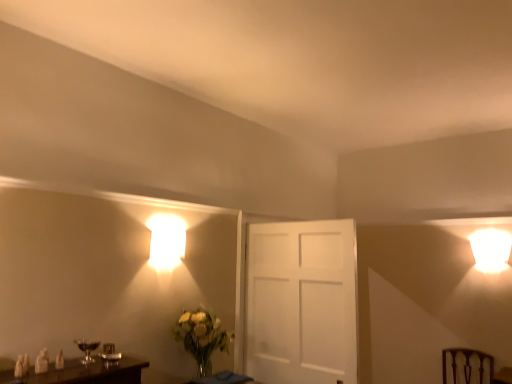
The image size is (512, 384). What do you see at coordinates (87, 349) in the screenshot?
I see `matte glass wine glass at lower left` at bounding box center [87, 349].

The height and width of the screenshot is (384, 512). Describe the element at coordinates (223, 378) in the screenshot. I see `translucent glass table at lower center` at that location.

The image size is (512, 384). Describe the element at coordinates (466, 363) in the screenshot. I see `brown wooden swivel chair at lower right` at that location.

What do you see at coordinates (202, 337) in the screenshot? I see `translucent glass vase at lower left` at bounding box center [202, 337].

In order to face translucent glass vase at lower left, should I rotate leftwards or rightwards?

To align with it, rotate left about 6.662°.

Where is `matte glass wine glass at lower left`? matte glass wine glass at lower left is located at coordinates (87, 349).

Is translucent glass vase at lower left not near matte glass wine glass at lower left?

No.

At what (x,y) coordinates should I click in order to perform the action: click on floral arrangement below the matte glass wine glass at lower left (from a real-world perspective). Please return your answer as a coordinate pair (x, y). Image resolution: width=512 pixels, height=384 pixels. Looking at the image, I should click on (202, 337).

From a real-world perspective, relative to matte glass wine glass at lower left, is translucent glass vase at lower left vertically above or below?

Clearly, from a real-world perspective, translucent glass vase at lower left is below matte glass wine glass at lower left.

Can you confirm if translucent glass vase at lower left is positioned to the left of matte glass wine glass at lower left?

No, translucent glass vase at lower left is not to the left of matte glass wine glass at lower left.

Based on the photo, how different are the orientations of translucent glass vase at lower left and translucent glass table at lower center in degrees?

The angle between the facing direction of translucent glass vase at lower left and the facing direction of translucent glass table at lower center is 1.85 degrees.

Is translucent glass vase at lower left oriented away from translucent glass table at lower center?

No, translucent glass table at lower center is not at the back of translucent glass vase at lower left.

Is point (207, 365) behind point (246, 382)?

That is False.

Is point (233, 377) positioned before point (470, 372)?

Yes, it is.

In order to click on table above the brown wooden swivel chair at lower right (from a real-world perspective) in this screenshot , I will do `click(223, 378)`.

From the image's perspective, relative to brown wooden swivel chair at lower right, is translucent glass table at lower center above or below?

From the image's perspective, translucent glass table at lower center appears above brown wooden swivel chair at lower right.

In the scene shown: Which is in front, matte glass wine glass at lower left or translucent glass table at lower center?

matte glass wine glass at lower left is in front.

Is point (90, 351) positioned in front of point (219, 376)?

Yes, point (90, 351) is in front of point (219, 376).

Considering the sizes of objects matte glass wine glass at lower left and translucent glass table at lower center in the image provided, who is thinner, matte glass wine glass at lower left or translucent glass table at lower center?

matte glass wine glass at lower left is thinner.

Can we say matte glass wine glass at lower left lies outside translucent glass table at lower center?

That's correct, matte glass wine glass at lower left is outside of translucent glass table at lower center.

Is brown wooden swivel chair at lower right placed right next to translucent glass vase at lower left?

No, brown wooden swivel chair at lower right is not in contact with translucent glass vase at lower left.

Locate an element on the screen. The image size is (512, 384). swivel chair that is below the translucent glass vase at lower left (from the image's perspective) is located at coordinates coord(466,363).

Which object is positioned more to the right, brown wooden swivel chair at lower right or translucent glass vase at lower left?

brown wooden swivel chair at lower right.

Does matte glass wine glass at lower left appear on the right side of translucent glass vase at lower left?

In fact, matte glass wine glass at lower left is to the left of translucent glass vase at lower left.

Is matte glass wine glass at lower left not close to translucent glass vase at lower left?

matte glass wine glass at lower left is near translucent glass vase at lower left, not far away.

Which of these two, matte glass wine glass at lower left or translucent glass vase at lower left, is smaller?

Smaller between the two is matte glass wine glass at lower left.

Which is behind, point (94, 349) or point (177, 340)?

The point (177, 340) is behind.

Is matte glass wine glass at lower left next to brown wooden swivel chair at lower right?

No, matte glass wine glass at lower left is not next to brown wooden swivel chair at lower right.

Could you tell me if matte glass wine glass at lower left is turned towards brown wooden swivel chair at lower right?

No, matte glass wine glass at lower left does not turn towards brown wooden swivel chair at lower right.

The image size is (512, 384). I want to click on table lamp in front of the brown wooden swivel chair at lower right, so click(x=87, y=349).

Considering the sizes of objects matte glass wine glass at lower left and brown wooden swivel chair at lower right in the image provided, who is shorter, matte glass wine glass at lower left or brown wooden swivel chair at lower right?

matte glass wine glass at lower left is shorter.

The image size is (512, 384). In the image, there is a matte glass wine glass at lower left. Identify the location of floral arrangement below it (from the image's perspective). (202, 337).

Where is `floral arrangement on the left of translucent glass table at lower center`? floral arrangement on the left of translucent glass table at lower center is located at coordinates [x=202, y=337].

Considering their positions, is translucent glass vase at lower left positioned closer to matte glass wine glass at lower left than brown wooden swivel chair at lower right?

The object closer to matte glass wine glass at lower left is translucent glass vase at lower left.

Estimate the real-world distances between objects in this image. Which object is further from translucent glass table at lower center, matte glass wine glass at lower left or brown wooden swivel chair at lower right?

brown wooden swivel chair at lower right is further to translucent glass table at lower center.

Estimate the real-world distances between objects in this image. Which object is further from translucent glass vase at lower left, matte glass wine glass at lower left or translucent glass table at lower center?

matte glass wine glass at lower left lies further to translucent glass vase at lower left than the other object.

From the image, which object appears to be farther from matte glass wine glass at lower left, brown wooden swivel chair at lower right or translucent glass vase at lower left?

Based on the image, brown wooden swivel chair at lower right appears to be further to matte glass wine glass at lower left.

Considering their positions, is matte glass wine glass at lower left positioned further to translucent glass vase at lower left than brown wooden swivel chair at lower right?

brown wooden swivel chair at lower right.

From the image, which object appears to be farther from translucent glass table at lower center, brown wooden swivel chair at lower right or matte glass wine glass at lower left?

brown wooden swivel chair at lower right lies further to translucent glass table at lower center than the other object.

Considering their positions, is translucent glass vase at lower left positioned closer to brown wooden swivel chair at lower right than translucent glass table at lower center?

translucent glass table at lower center lies closer to brown wooden swivel chair at lower right than the other object.

Looking at the image, which one is located further to brown wooden swivel chair at lower right, translucent glass table at lower center or translucent glass vase at lower left?

translucent glass vase at lower left is further to brown wooden swivel chair at lower right.

At what (x,y) coordinates should I click in order to perform the action: click on table between matte glass wine glass at lower left and brown wooden swivel chair at lower right from left to right. Please return your answer as a coordinate pair (x, y). Looking at the image, I should click on (223, 378).

Identify the location of table located between translucent glass vase at lower left and brown wooden swivel chair at lower right in the left-right direction. (223, 378).

Where is `floral arrangement situated between matte glass wine glass at lower left and brown wooden swivel chair at lower right from left to right`? floral arrangement situated between matte glass wine glass at lower left and brown wooden swivel chair at lower right from left to right is located at coordinates (202, 337).

Find the location of `floral arrangement situated between matte glass wine glass at lower left and translucent glass table at lower center from left to right`. floral arrangement situated between matte glass wine glass at lower left and translucent glass table at lower center from left to right is located at coordinates (202, 337).